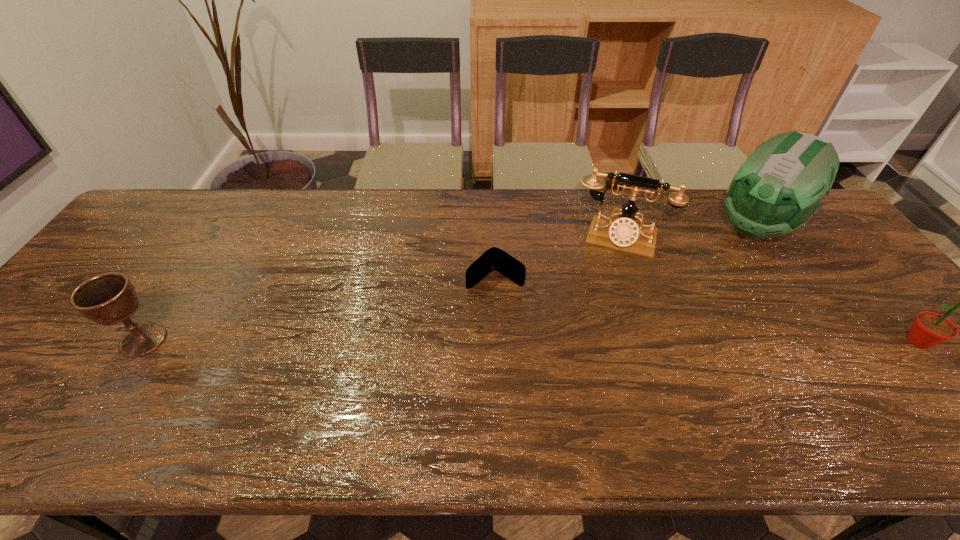
Where is `vacant space situated 0.310m on the dial of the telephone`? This screenshot has height=540, width=960. vacant space situated 0.310m on the dial of the telephone is located at coordinates (589, 339).

This screenshot has width=960, height=540. Find the location of `free space located on the dial of the telephone`. free space located on the dial of the telephone is located at coordinates (591, 333).

You are a GUI agent. You are given a task and a screenshot of the screen. Output one action in this format:
    pyautogui.click(x=<x>, y=<y>)
    Task: Click on the vacant space located 0.180m on the outer surface of the second object from left to right
    This screenshot has height=540, width=960.
    Given the screenshot: What is the action you would take?
    pyautogui.click(x=428, y=330)

The image size is (960, 540). Find the location of `free spot located 0.190m on the outer surface of the second object from left to right`. free spot located 0.190m on the outer surface of the second object from left to right is located at coordinates (425, 332).

I want to click on vacant region located on the outer surface of the second object from left to right, so click(461, 302).

Locate an element on the screen. vacant space located on the visor of the tallest object is located at coordinates (677, 304).

In order to click on vacant area situated on the visor of the tallest object in this screenshot , I will do (x=711, y=271).

Find the location of a particular element. The width and height of the screenshot is (960, 540). free space located on the visor of the tallest object is located at coordinates (709, 272).

At what (x,y) coordinates should I click in order to perform the action: click on telephone located at the far edge. Please return your answer as a coordinate pair (x, y). The width and height of the screenshot is (960, 540). Looking at the image, I should click on (623, 233).

At what (x,y) coordinates should I click in order to perform the action: click on football helmet situated at the far edge. Please return your answer as a coordinate pair (x, y). Looking at the image, I should click on (779, 187).